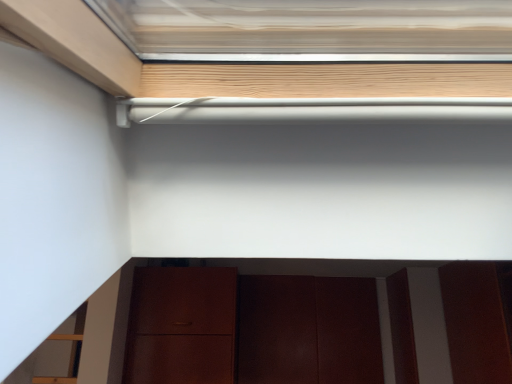
Question: From the image's perspective, is dark wood door at lower center above or below matte brown cabinet at lower center?

Choices:
 (A) below
 (B) above

Answer: (A)

Question: Choose the correct answer: Is dark wood door at lower center inside matte brown cabinet at lower center or outside it?

Choices:
 (A) outside
 (B) inside

Answer: (B)

Question: In terms of height, does dark wood door at lower center look taller or shorter compared to matte brown cabinet at lower center?

Choices:
 (A) short
 (B) tall

Answer: (B)

Question: Looking at their shapes, would you say matte brown cabinet at lower center is wider or thinner than dark wood door at lower center?

Choices:
 (A) thin
 (B) wide

Answer: (B)

Question: From a real-world perspective, is matte brown cabinet at lower center physically located above or below dark wood door at lower center?

Choices:
 (A) above
 (B) below

Answer: (A)

Question: Would you say matte brown cabinet at lower center is to the left or to the right of dark wood door at lower center in the picture?

Choices:
 (A) left
 (B) right

Answer: (B)

Question: From their relative heights in the image, would you say matte brown cabinet at lower center is taller or shorter than dark wood door at lower center?

Choices:
 (A) short
 (B) tall

Answer: (A)